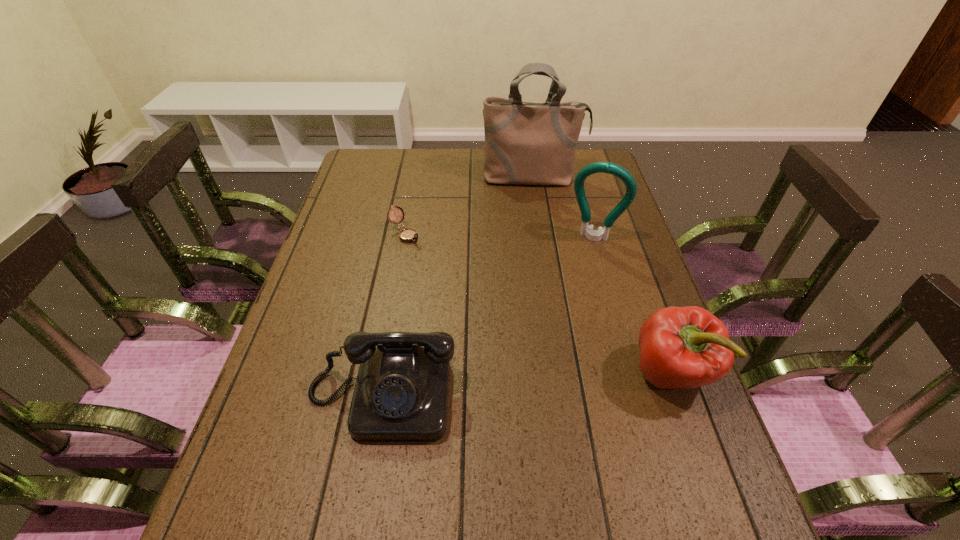
This screenshot has height=540, width=960. Find the location of `vacant space situated at the jaws of the bottle opener`. vacant space situated at the jaws of the bottle opener is located at coordinates (557, 330).

Where is `free spot located 0.290m on the front-facing side of the farthest object`? free spot located 0.290m on the front-facing side of the farthest object is located at coordinates (540, 247).

Identify the location of free region located on the front-facing side of the farthest object. This screenshot has height=540, width=960. (540, 241).

Find the location of `free space located 0.400m on the front-facing side of the farthest object`. free space located 0.400m on the front-facing side of the farthest object is located at coordinates (544, 274).

Where is `free spot located on the face of the compass`? free spot located on the face of the compass is located at coordinates (448, 275).

Locate an element on the screen. vacant space located 0.060m on the face of the compass is located at coordinates (425, 255).

Find the location of a particular element. This screenshot has width=960, height=540. free location located 0.140m on the face of the compass is located at coordinates (442, 269).

The width and height of the screenshot is (960, 540). What are the coordinates of `object located at the far edge` in the screenshot? It's located at (526, 143).

Where is `object that is positioned at the near edge`? The width and height of the screenshot is (960, 540). object that is positioned at the near edge is located at coordinates (401, 393).

This screenshot has height=540, width=960. Find the location of `object that is at the left edge`. object that is at the left edge is located at coordinates (401, 393).